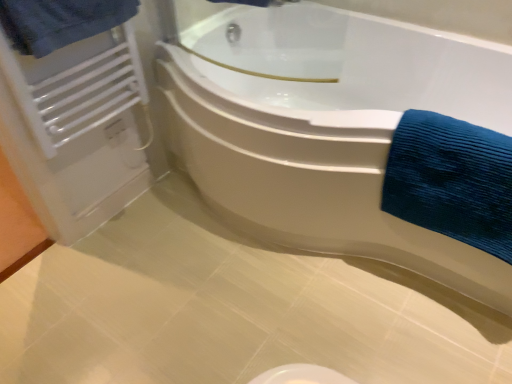
This screenshot has width=512, height=384. Find the location of `blank area beneath white metallic radiator at upper left (from a real-world perspective)`. blank area beneath white metallic radiator at upper left (from a real-world perspective) is located at coordinates (143, 193).